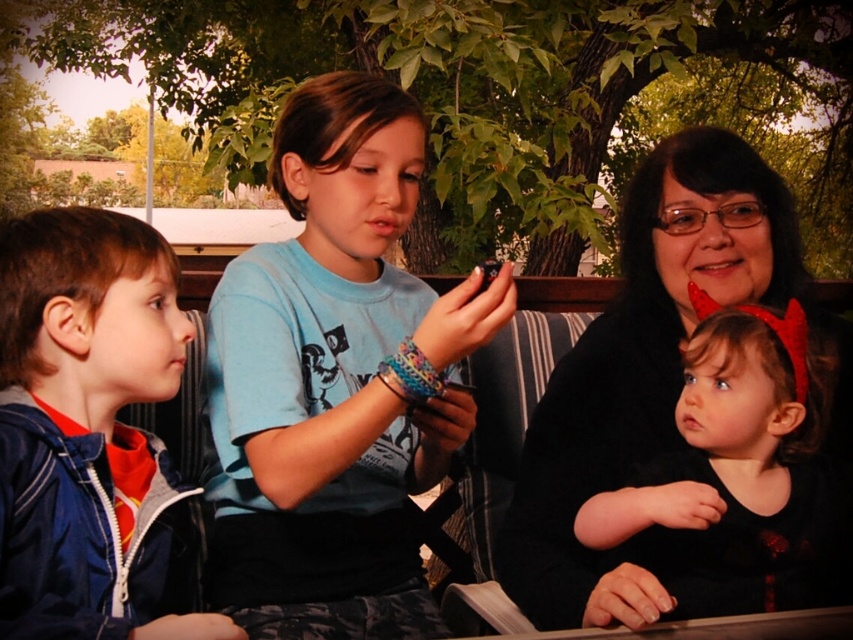
Question: Can you confirm if blue t-shirt at center is positioned to the right of black matte hair at upper right?

Choices:
 (A) yes
 (B) no

Answer: (B)

Question: Can you confirm if blue t-shirt at center is positioned to the right of black matte hair at upper right?

Choices:
 (A) yes
 (B) no

Answer: (B)

Question: Among these objects, which one is nearest to the camera?

Choices:
 (A) blue t-shirt at center
 (B) blue denim jacket at left
 (C) black matte hair at upper right

Answer: (B)

Question: Among these objects, which one is nearest to the camera?

Choices:
 (A) blue t-shirt at center
 (B) black matte hair at upper right

Answer: (B)

Question: Estimate the real-world distances between objects in this image. Which object is farther from the blue t-shirt at center?

Choices:
 (A) blue denim jacket at left
 (B) black matte hair at upper right

Answer: (B)

Question: Does blue t-shirt at center have a lesser width compared to blue denim jacket at left?

Choices:
 (A) yes
 (B) no

Answer: (B)